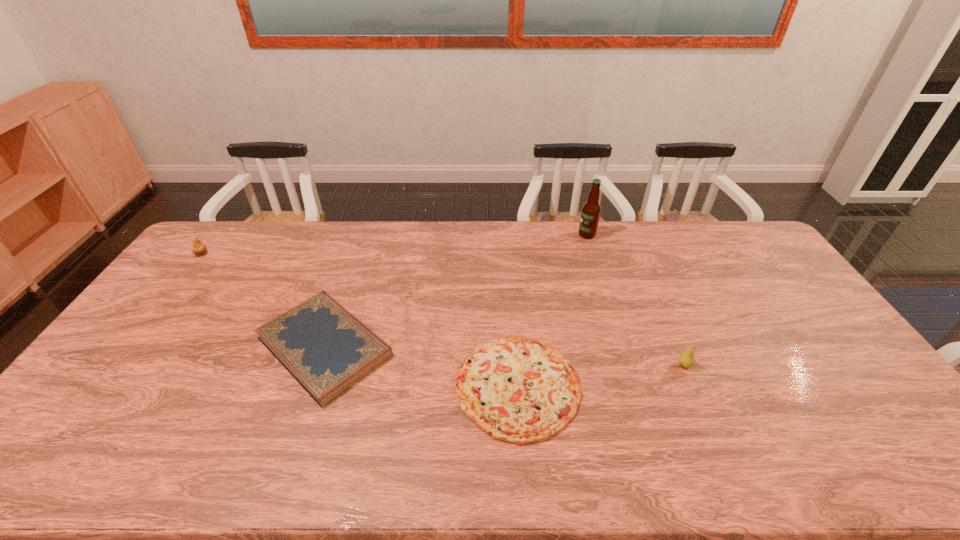
This screenshot has height=540, width=960. I want to click on object at the left edge, so click(198, 248).

What are the coordinates of `object present at the far left corner` in the screenshot? It's located at (198, 248).

Locate an element on the screen. The image size is (960, 540). free space at the far edge of the desktop is located at coordinates (423, 252).

In the image, there is a desktop. Identify the location of free space at the near edge. The height and width of the screenshot is (540, 960). (626, 459).

In the image, there is a desktop. In order to click on free region at the left edge in this screenshot , I will do pyautogui.click(x=127, y=418).

Identify the location of vacant space at the right edge of the desktop. Image resolution: width=960 pixels, height=540 pixels. coord(869,426).

Identify the location of vacant point at the far left corner. Image resolution: width=960 pixels, height=540 pixels. (239, 239).

The image size is (960, 540). Find the location of `vacant region between the shortest object and the fourth tallest object`. vacant region between the shortest object and the fourth tallest object is located at coordinates (420, 366).

This screenshot has height=540, width=960. I want to click on vacant area between the third object from right to left and the farther pear, so click(360, 320).

The height and width of the screenshot is (540, 960). What are the coordinates of `free spot between the second object from right to left and the nearer pear` in the screenshot? It's located at (636, 300).